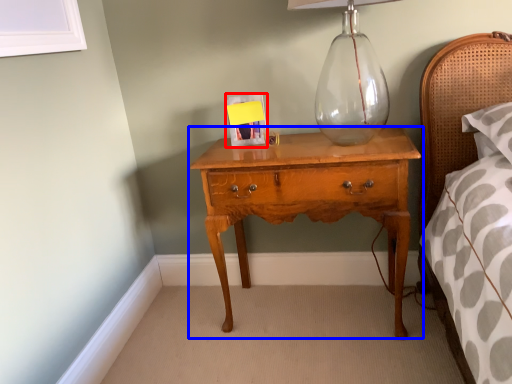
Question: Which point is further to the camera, picture frame (highlighted by a red box) or nightstand (highlighted by a blue box)?

Choices:
 (A) picture frame
 (B) nightstand

Answer: (A)